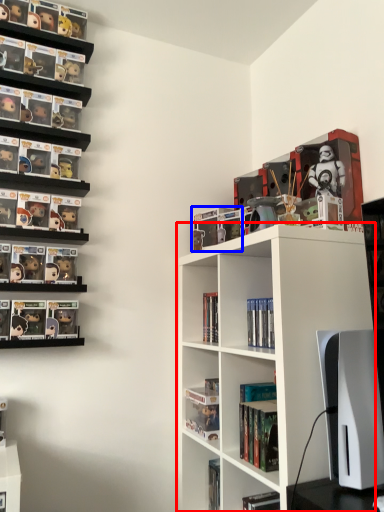
Question: Which object appears closest to the camera in this image, shelf (highlighted by a red box) or book (highlighted by a blue box)?

Choices:
 (A) shelf
 (B) book

Answer: (A)